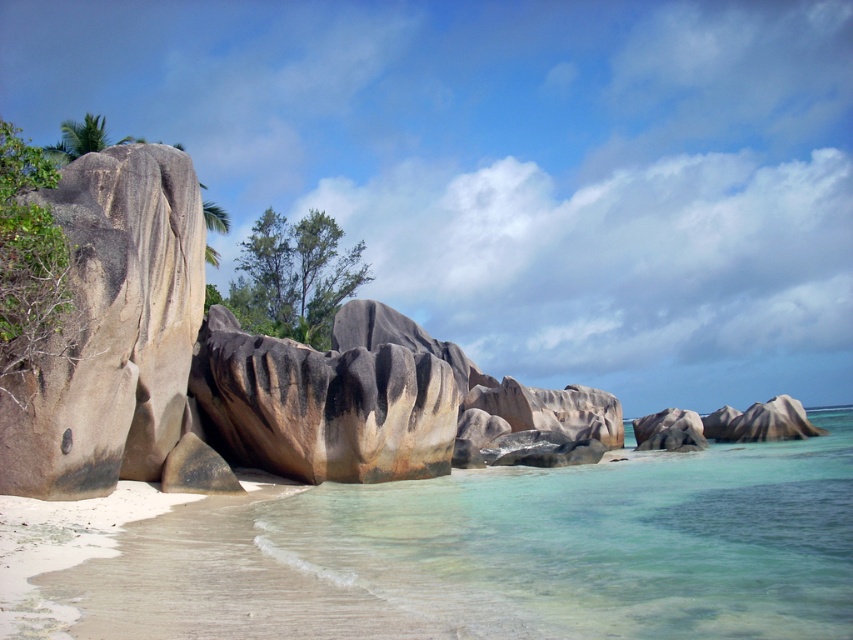
You are standing on the beach and want to reach the clear glassy water at lower center. The coordinates given are point (601,541). Can you determine if this point is in the water or on the sand?

The point (601,541) corresponds to clear glassy water at lower center, so it is in the water.

You are standing on the sandy shore looking out at the clear glassy water at lower center and the rustic stone boulder at left. Which object is positioned to the left of the other?

The rustic stone boulder at left is positioned to the left of the clear glassy water at lower center.